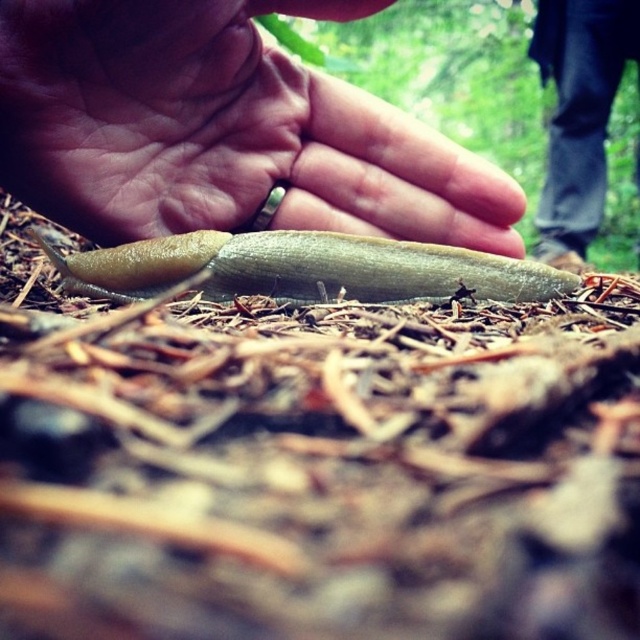
You are a photographer trying to focus on two points in the scene. The first point is at coordinates point (109, 8) and the second is at point (96, 266). Given that the camera can only focus on one point at a time, which point should you choose to ensure the slug is in focus?

Point (109, 8) is closer to the camera than point (96, 266). Therefore, focusing on point (109, 8) will ensure the slug is in focus.

You are a jeweler examining a customer who wants to place the matte gold ring at center on their finger. The customer mentions they have a green slimy snail at center on their hand. Can you determine if the ring will fit over the snail?

The matte gold ring at center is wider than the green slimy snail at center, so the ring can fit over the snail since its width is greater.

You are a nature photographer trying to capture a closeup of the green slimy snail at center. However, the matte gold ring at center is blocking your view. Can you determine if the ring is in front of or behind the snail?

The matte gold ring at center is in front of the green slimy snail at center, so it is blocking the view.